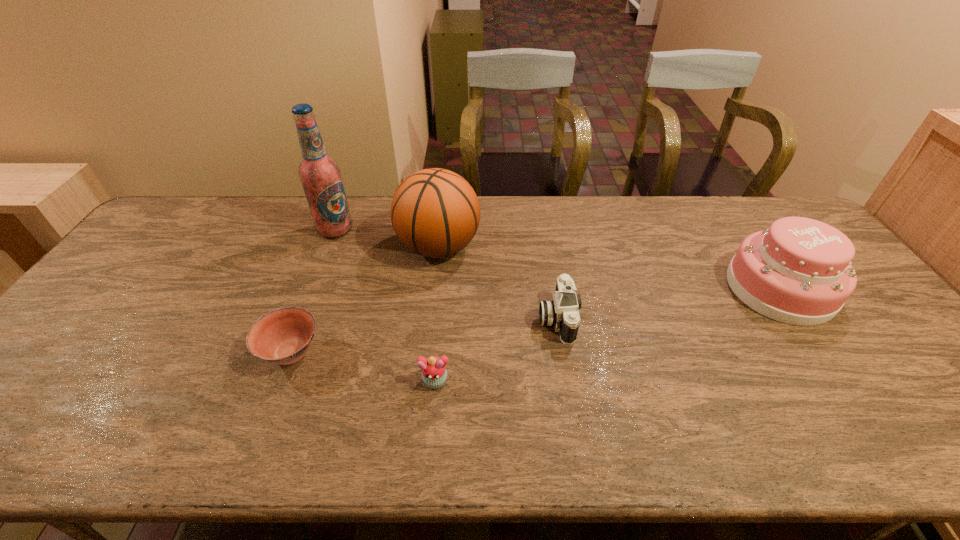
Locate an element on the screen. free point between the tallest object and the cupcake is located at coordinates (385, 305).

Locate an element on the screen. Image resolution: width=960 pixels, height=540 pixels. object that is the fifth closest one to the fifth object from left to right is located at coordinates (320, 175).

Identify which object is the fifth closest to the second object from right to left. Please provide its 2D coordinates. Your answer should be formatted as a tuple, i.e. [(x, y)], where the tuple contains the x and y coordinates of a point satisfying the conditions above.

[(320, 175)]

Where is `blank space that satisfies the following two spatial constraints: 1. on the back side of the cake; 2. on the left side of the camera`? blank space that satisfies the following two spatial constraints: 1. on the back side of the cake; 2. on the left side of the camera is located at coordinates (552, 288).

What are the coordinates of `vacant area that satisfies the following two spatial constraints: 1. on the back side of the camera; 2. on the right side of the bowl` in the screenshot? It's located at (304, 318).

Where is `free space that satisfies the following two spatial constraints: 1. on the back side of the second object from right to left; 2. on the left side of the bowl`? free space that satisfies the following two spatial constraints: 1. on the back side of the second object from right to left; 2. on the left side of the bowl is located at coordinates (304, 318).

Where is `free spot that satisfies the following two spatial constraints: 1. on the back side of the third shortest object; 2. on the left side of the rightmost object`? This screenshot has height=540, width=960. free spot that satisfies the following two spatial constraints: 1. on the back side of the third shortest object; 2. on the left side of the rightmost object is located at coordinates (552, 288).